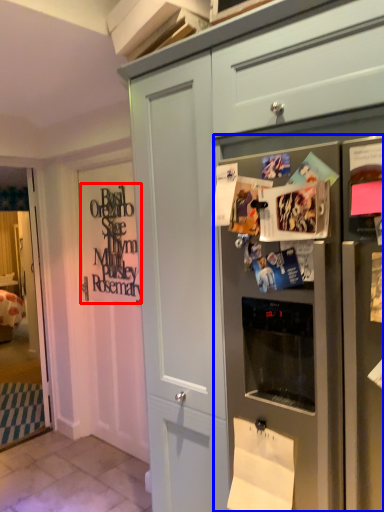
Question: Which point is further to the camera, signature (highlighted by a red box) or refrigerator (highlighted by a blue box)?

Choices:
 (A) signature
 (B) refrigerator

Answer: (A)